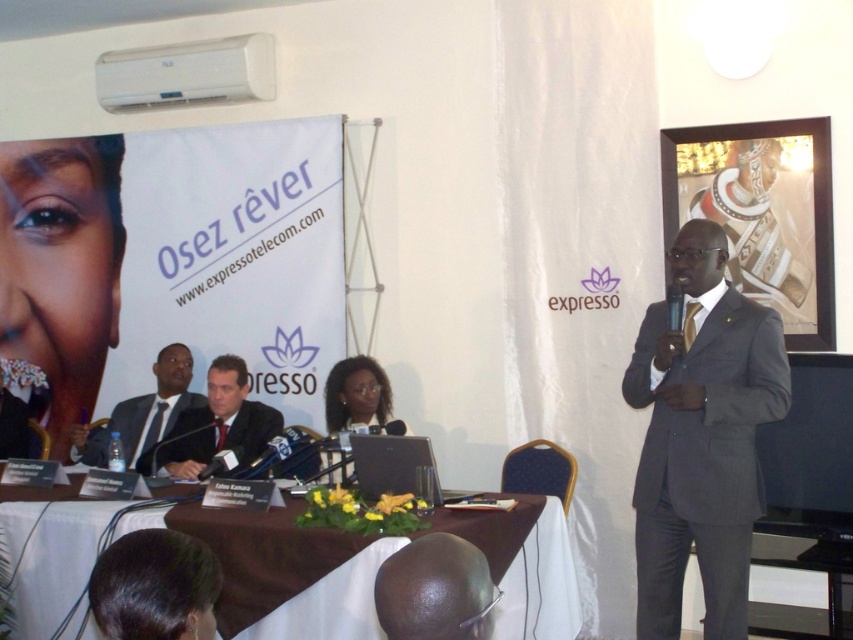
Does matte black face at left appear under dark gray suit at lower left?

Incorrect, matte black face at left is not positioned below dark gray suit at lower left.

Can you confirm if matte black face at left is smaller than dark gray suit at lower left?

No.

Is point (9, 259) closer to viewer compared to point (132, 464)?

No, (9, 259) is further to viewer.

The height and width of the screenshot is (640, 853). In order to click on matte black face at left in this screenshot , I will do `click(61, 268)`.

This screenshot has width=853, height=640. I want to click on matte black face at left, so click(x=61, y=268).

Is point (9, 168) positioned after point (184, 436)?

Yes, point (9, 168) is farther from viewer.

Measure the distance between matte black face at left and camera.

matte black face at left is 17.23 feet from camera.

I want to click on matte black face at left, so click(x=61, y=268).

Can you confirm if matte black face at left is shorter than matte black laptop at center?

No.

Is matte black face at left taller than matte black laptop at center?

Yes.

What are the coordinates of `matte black face at left` in the screenshot? It's located at (61, 268).

The image size is (853, 640). Find the location of `matte black face at left`. matte black face at left is located at coordinates (61, 268).